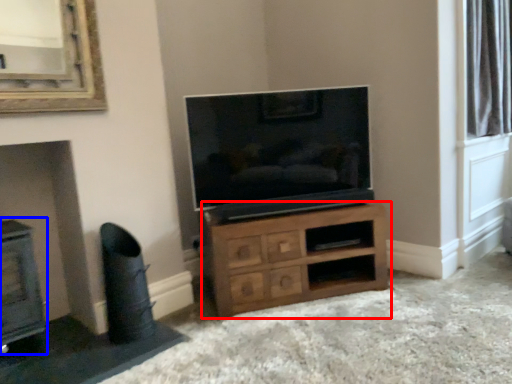
Question: Which of the following is the farthest to the observer, chest of drawers (highlighted by a red box) or fireplace (highlighted by a blue box)?

Choices:
 (A) chest of drawers
 (B) fireplace

Answer: (A)